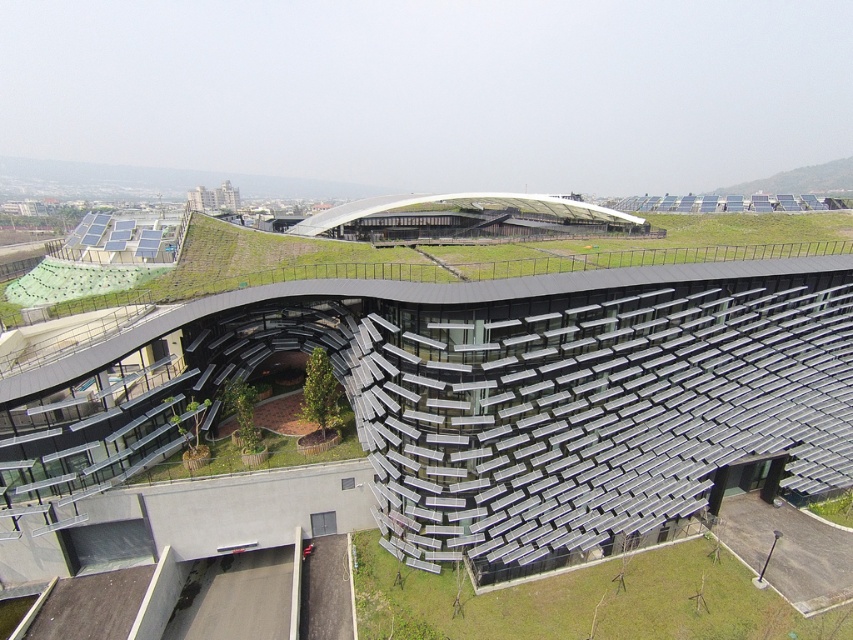
Can you confirm if metallic solar panels at center is bigger than green grass at lower center?

Yes, metallic solar panels at center is bigger than green grass at lower center.

Does point (782, 452) come closer to viewer compared to point (428, 588)?

No, (782, 452) is further to viewer.

You are a GUI agent. You are given a task and a screenshot of the screen. Output one action in this format:
    pyautogui.click(x=<x>, y=<y>)
    Task: Click on the metallic solar panels at center
    
    Given the screenshot: What is the action you would take?
    pyautogui.click(x=505, y=396)